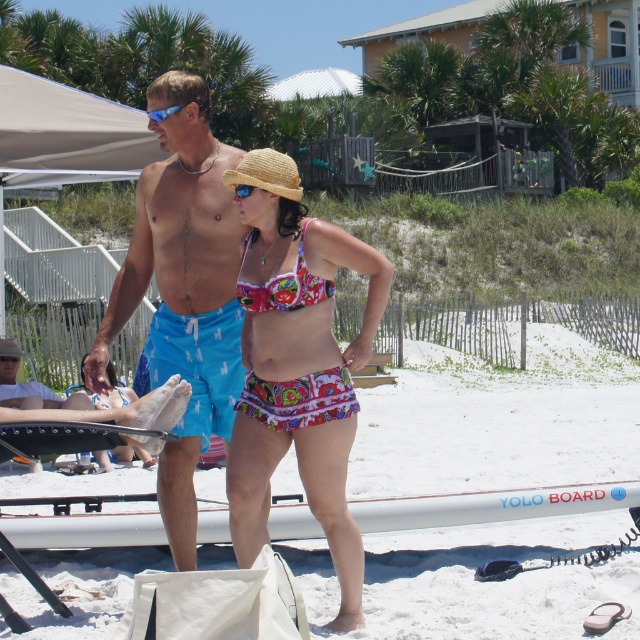
Does blue printed shorts at center have a greater width compared to blue plastic goggles at center?

Indeed, blue printed shorts at center has a greater width compared to blue plastic goggles at center.

Between blue printed shorts at center and blue plastic goggles at center, which one appears on the right side from the viewer's perspective?

From the viewer's perspective, blue plastic goggles at center appears more on the right side.

Describe the element at coordinates (182, 291) in the screenshot. I see `blue printed shorts at center` at that location.

This screenshot has width=640, height=640. In order to click on blue printed shorts at center in this screenshot , I will do `click(182, 291)`.

How much distance is there between floral bikini at center and strawmaterial/texturehat at center?

floral bikini at center and strawmaterial/texturehat at center are 85.35 centimeters apart from each other.

Between floral bikini at center and strawmaterial/texturehat at center, which one is positioned lower?

floral bikini at center is below.

What do you see at coordinates (298, 365) in the screenshot?
I see `floral bikini at center` at bounding box center [298, 365].

At what (x,y) coordinates should I click in order to perform the action: click on floral bikini at center. Please return your answer as a coordinate pair (x, y). Looking at the image, I should click on click(298, 365).

Is floral bikini at center thinner than floral fabric bikini top at center?

No, floral bikini at center is not thinner than floral fabric bikini top at center.

Describe the element at coordinates (298, 365) in the screenshot. This screenshot has width=640, height=640. I see `floral bikini at center` at that location.

Is point (237, 467) more distant than point (304, 268)?

Yes, point (237, 467) is farther from viewer.

Identify the location of floral bikini at center. (298, 365).